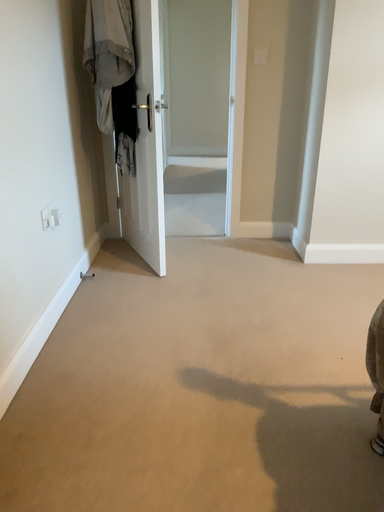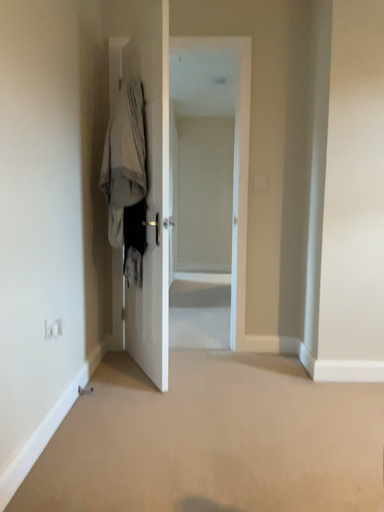
Question: How did the camera likely rotate when shooting the video?

Choices:
 (A) rotated upward
 (B) rotated downward

Answer: (A)